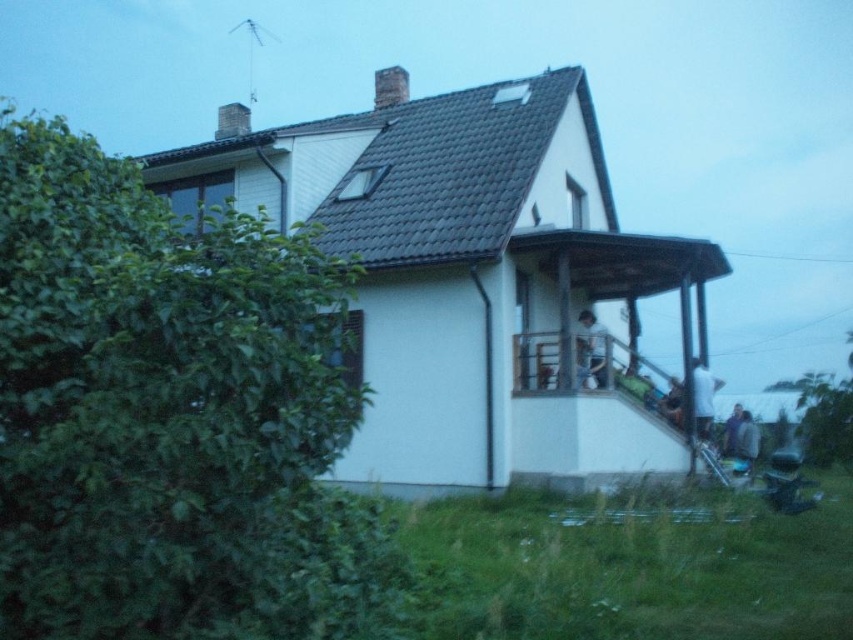
Question: Estimate the real-world distances between objects in this image. Which object is closer to the blue denim jeans at lower right?

Choices:
 (A) smooth brown hair at upper right
 (B) white fabric shirt at upper center
 (C) light brown leather jacket at lower right

Answer: (C)

Question: In this image, where is smooth brown hair at upper right located relative to blue denim jeans at lower right?

Choices:
 (A) above
 (B) below

Answer: (A)

Question: Which is farther from the white fabric shirt at upper center?

Choices:
 (A) smooth brown hair at upper right
 (B) white matte shirt at right
 (C) light brown leather jacket at lower right
 (D) blue denim jeans at lower right

Answer: (C)

Question: Is white matte shirt at right further to the viewer compared to light brown leather jacket at lower right?

Choices:
 (A) no
 (B) yes

Answer: (A)

Question: Is white matte shirt at right in front of blue denim jeans at lower right?

Choices:
 (A) no
 (B) yes

Answer: (B)

Question: Which object is positioned farthest from the blue denim jeans at lower right?

Choices:
 (A) smooth brown hair at upper right
 (B) light brown leather jacket at lower right
 (C) white fabric shirt at upper center
 (D) white matte shirt at right

Answer: (C)